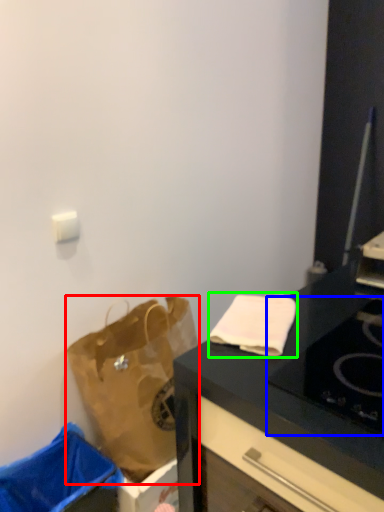
Question: Which is nearer to the handbag (highlighted by a red box)? gas stove (highlighted by a blue box) or cloth (highlighted by a green box).

Choices:
 (A) gas stove
 (B) cloth

Answer: (B)